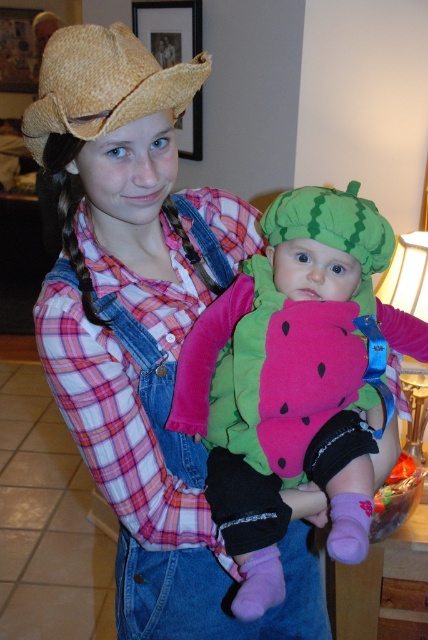
Which is behind, point (116, 346) or point (345, 332)?

The point (116, 346) is behind.

I want to click on denim overall at center, so click(143, 330).

Is point (202, 579) less distant than point (252, 440)?

No, (202, 579) is further to viewer.

I want to click on denim overall at center, so click(x=143, y=330).

Is point (350, 358) more distant than point (124, 113)?

Yes, point (350, 358) is behind point (124, 113).

Can you confirm if soft pink fabric watermelon at center is bigger than straw hat at upper left?

Indeed, soft pink fabric watermelon at center has a larger size compared to straw hat at upper left.

Between point (282, 244) and point (133, 60), which one is positioned in front?

Positioned in front is point (133, 60).

You are a GUI agent. You are given a task and a screenshot of the screen. Output one action in this format:
    pyautogui.click(x=<x>, y=<y>)
    Task: Click on the soft pink fabric watermelon at center
    The image size is (428, 640).
    Given the screenshot: What is the action you would take?
    pyautogui.click(x=294, y=380)

Which of these two, denim overall at center or straw hat at upper left, stands shorter?

With less height is straw hat at upper left.

Is denim overall at center bigger than straw hat at upper left?

Yes, denim overall at center is bigger than straw hat at upper left.

Find the location of a particular element. This screenshot has height=640, width=428. denim overall at center is located at coordinates (143, 330).